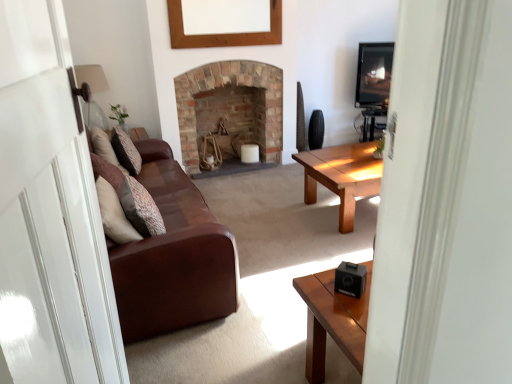
Question: Can you confirm if black plastic speaker at lower right is taller than patterned fabric pillow at left, marked as the 2th pillow in a left-to-right arrangement?

Choices:
 (A) yes
 (B) no

Answer: (B)

Question: Does black plastic speaker at lower right appear on the left side of patterned fabric pillow at left, which appears as the first pillow when ordered from the bottom?

Choices:
 (A) no
 (B) yes

Answer: (A)

Question: Is black plastic speaker at lower right positioned behind patterned fabric pillow at left, marked as the 2th pillow in a left-to-right arrangement?

Choices:
 (A) yes
 (B) no

Answer: (B)

Question: Can we say black plastic speaker at lower right lies outside patterned fabric pillow at left, the 2th pillow from the back?

Choices:
 (A) no
 (B) yes

Answer: (B)

Question: Considering the relative sizes of black plastic speaker at lower right and patterned fabric pillow at left, the 2th pillow from the back, in the image provided, is black plastic speaker at lower right smaller than patterned fabric pillow at left, the 2th pillow from the back,?

Choices:
 (A) yes
 (B) no

Answer: (A)

Question: Considering the relative sizes of black plastic speaker at lower right and patterned fabric pillow at left, the first pillow in the front-to-back sequence, in the image provided, is black plastic speaker at lower right shorter than patterned fabric pillow at left, the first pillow in the front-to-back sequence,?

Choices:
 (A) no
 (B) yes

Answer: (B)

Question: From the image's perspective, is matte glass lampshade at upper left over patterned fabric pillow at left, which appears as the first pillow when ordered from the bottom?

Choices:
 (A) no
 (B) yes

Answer: (B)

Question: Considering the relative sizes of matte glass lampshade at upper left and patterned fabric pillow at left, the first pillow positioned from the right, in the image provided, is matte glass lampshade at upper left shorter than patterned fabric pillow at left, the first pillow positioned from the right,?

Choices:
 (A) yes
 (B) no

Answer: (B)

Question: Is the depth of matte glass lampshade at upper left greater than that of patterned fabric pillow at left, the 2th pillow from the back?

Choices:
 (A) no
 (B) yes

Answer: (B)

Question: Can you confirm if matte glass lampshade at upper left is bigger than patterned fabric pillow at left, the 2th pillow from the back?

Choices:
 (A) no
 (B) yes

Answer: (B)

Question: From a real-world perspective, is matte glass lampshade at upper left over patterned fabric pillow at left, the 2th pillow from the back?

Choices:
 (A) yes
 (B) no

Answer: (A)

Question: Considering the relative positions of matte glass lampshade at upper left and patterned fabric pillow at left, which appears as the first pillow when ordered from the bottom, in the image provided, is matte glass lampshade at upper left to the right of patterned fabric pillow at left, which appears as the first pillow when ordered from the bottom, from the viewer's perspective?

Choices:
 (A) no
 (B) yes

Answer: (A)

Question: Could you tell me if transparent glass door at left is facing matte glass lampshade at upper left?

Choices:
 (A) no
 (B) yes

Answer: (A)